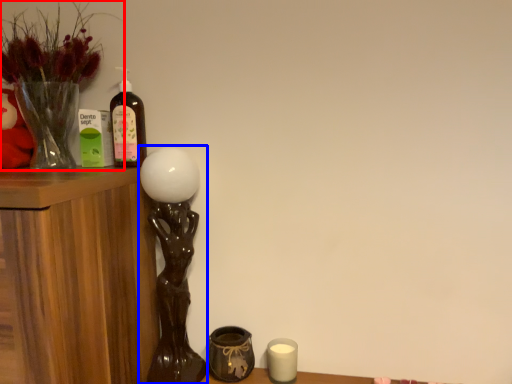
Question: Which object is further to the camera taking this photo, houseplant (highlighted by a red box) or table lamp (highlighted by a blue box)?

Choices:
 (A) houseplant
 (B) table lamp

Answer: (B)